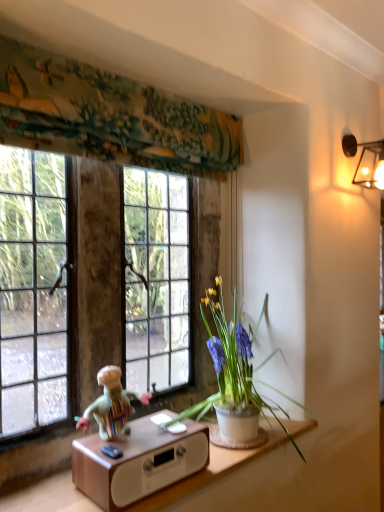
At what (x,y) coordinates should I click in order to perform the action: click on empty space that is ontop of textured fabric at upper center (from a real-world perspective). Please return your answer as a coordinate pair (x, y). Image resolution: width=384 pixels, height=512 pixels. Looking at the image, I should click on (137, 78).